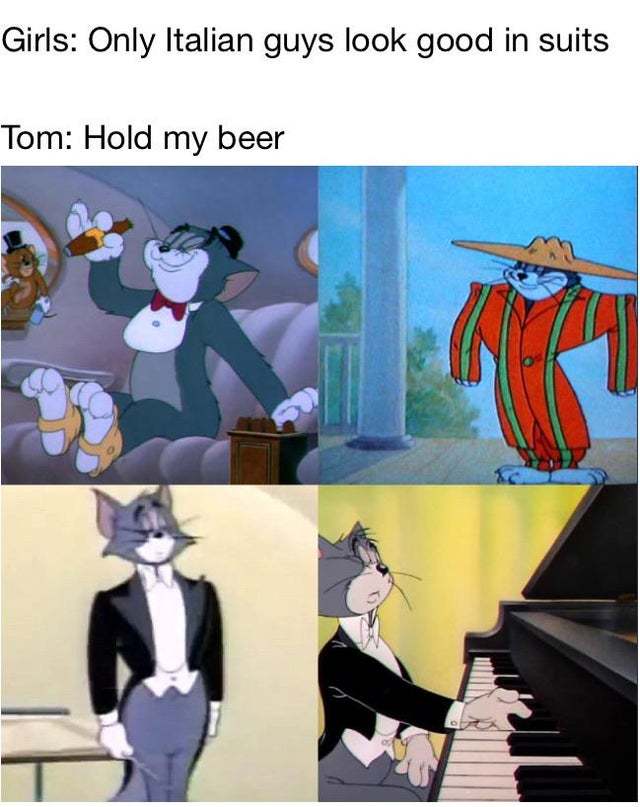
Locate an element on the screen. The width and height of the screenshot is (640, 807). black piano keys is located at coordinates (498, 659).